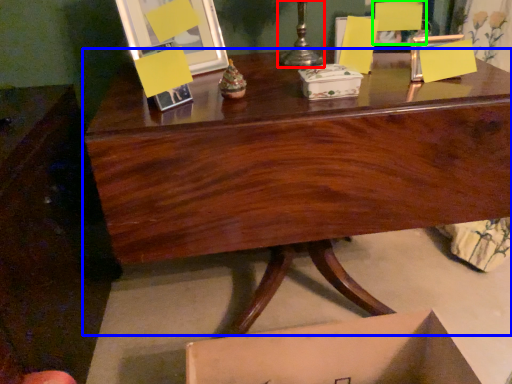
Question: Which object is positioned farthest from candle holder (highlighted by a red box)? Select from desk (highlighted by a blue box) and armchair (highlighted by a green box).

Choices:
 (A) desk
 (B) armchair

Answer: (A)